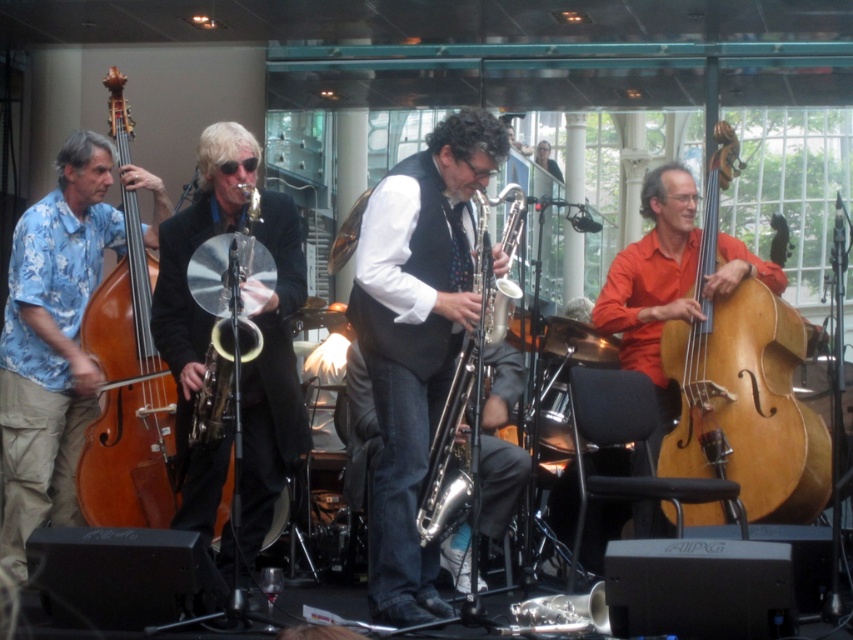
Who is positioned more to the left, shiny silver saxophone at center or natural wood cello at right?

From the viewer's perspective, shiny silver saxophone at center appears more on the left side.

Describe the element at coordinates (416, 339) in the screenshot. Image resolution: width=853 pixels, height=640 pixels. I see `shiny silver saxophone at center` at that location.

The image size is (853, 640). I want to click on shiny silver saxophone at center, so click(x=416, y=339).

Is point (469, 323) closer to camera compared to point (138, 365)?

Yes.

Does shiny silver saxophone at center have a lesser width compared to wooden polished cello at left?

Incorrect, shiny silver saxophone at center's width is not less than wooden polished cello at left's.

You are a GUI agent. You are given a task and a screenshot of the screen. Output one action in this format:
    pyautogui.click(x=<x>, y=<y>)
    Task: Click on the shiny silver saxophone at center
    The image size is (853, 640).
    Given the screenshot: What is the action you would take?
    pyautogui.click(x=416, y=339)

Is point (363, 320) positioned after point (276, 236)?

No, (363, 320) is in front of (276, 236).

Is shiny silver saxophone at center wider than black shiny suit at center?

No.

Between point (457, 173) and point (184, 224), which one is positioned behind?

The point (184, 224) is behind.

Identify the location of shiny silver saxophone at center. (416, 339).